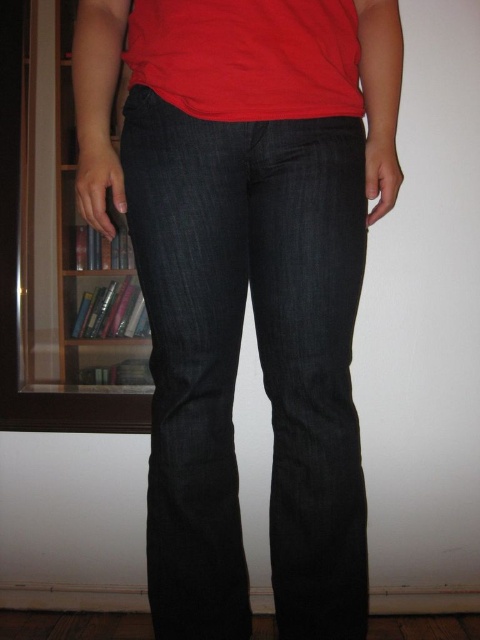
Question: Which point is farther to the camera?

Choices:
 (A) tap(226, 474)
 (B) tap(278, 13)

Answer: (A)

Question: Which point is closer to the camera?

Choices:
 (A) (217, 614)
 (B) (208, 19)

Answer: (B)

Question: Does dark denim jeans at center have a larger size compared to wooden bookshelf at left?

Choices:
 (A) yes
 (B) no

Answer: (A)

Question: Which of these objects is positioned closest to the dark denim jeans at center?

Choices:
 (A) wooden bookshelf at left
 (B) matte red t-shirt at upper center

Answer: (B)

Question: Can you confirm if dark denim jeans at center is positioned below matte red t-shirt at upper center?

Choices:
 (A) yes
 (B) no

Answer: (A)

Question: Is dark denim jeans at center to the left of matte red t-shirt at upper center from the viewer's perspective?

Choices:
 (A) yes
 (B) no

Answer: (B)